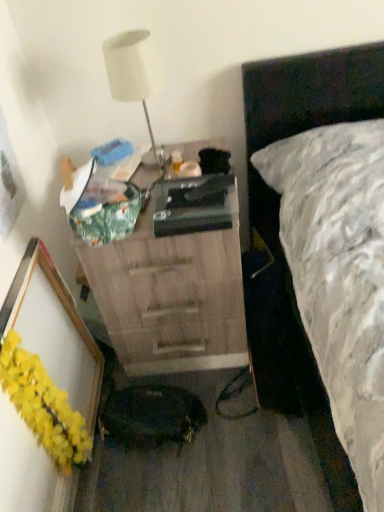
This screenshot has height=512, width=384. In order to click on yellow fluffy garland at lower left in this screenshot , I will do `click(43, 405)`.

Locate an element on the screen. Image resolution: width=384 pixels, height=512 pixels. wooden chest of drawers at center is located at coordinates (173, 290).

Are white matte lamp at upper left and yellow fluffy garland at lower left far apart?

That's not correct — white matte lamp at upper left is a little close to yellow fluffy garland at lower left.

Is point (109, 59) farther from viewer compared to point (73, 426)?

That is False.

Which is more to the left, white matte lamp at upper left or yellow fluffy garland at lower left?

Positioned to the left is yellow fluffy garland at lower left.

Between yellow fluffy garland at lower left and white matte lamp at upper left, which one is positioned in front?

yellow fluffy garland at lower left.

Is yellow fluffy garland at lower left positioned beyond the bounds of white matte lamp at upper left?

Yes.

From a real-world perspective, between yellow fluffy garland at lower left and white matte lamp at upper left, who is vertically higher?

white matte lamp at upper left is physically above.

Which is further, (11, 378) or (148, 167)?

Positioned behind is point (148, 167).

Does wooden chest of drawers at center have a greater width compared to white matte lamp at upper left?

A: Correct, the width of wooden chest of drawers at center exceeds that of white matte lamp at upper left.

Which object is closer to the camera, wooden chest of drawers at center or white matte lamp at upper left?

Positioned in front is wooden chest of drawers at center.

Is wooden chest of drawers at center oriented towards white matte lamp at upper left?

No, wooden chest of drawers at center is not turned towards white matte lamp at upper left.

The width and height of the screenshot is (384, 512). In order to click on the chest of drawers that appears below the white matte lamp at upper left (from a real-world perspective) in this screenshot , I will do `click(173, 290)`.

In the image, is wooden chest of drawers at center on the left side or the right side of yellow fluffy garland at lower left?

Based on their positions, wooden chest of drawers at center is located to the right of yellow fluffy garland at lower left.

The height and width of the screenshot is (512, 384). I want to click on chest of drawers on the right of yellow fluffy garland at lower left, so click(173, 290).

What's the angular difference between wooden chest of drawers at center and yellow fluffy garland at lower left's facing directions?

90 degrees.

Is wooden chest of drawers at center aimed at yellow fluffy garland at lower left?

No, wooden chest of drawers at center does not turn towards yellow fluffy garland at lower left.

Does white matte lamp at upper left have a smaller size compared to wooden chest of drawers at center?

Correct, white matte lamp at upper left occupies less space than wooden chest of drawers at center.

Is white matte lamp at upper left far away from wooden chest of drawers at center?

That's not correct — white matte lamp at upper left is a little close to wooden chest of drawers at center.

Do you think white matte lamp at upper left is within wooden chest of drawers at center, or outside of it?

white matte lamp at upper left is not inside wooden chest of drawers at center, it's outside.

Is wooden chest of drawers at center inside yellow fluffy garland at lower left?

No, wooden chest of drawers at center is not surrounded by yellow fluffy garland at lower left.

Is yellow fluffy garland at lower left positioned far away from wooden chest of drawers at center?

That's not correct — yellow fluffy garland at lower left is a little close to wooden chest of drawers at center.

Between yellow fluffy garland at lower left and wooden chest of drawers at center, which one has smaller width?

yellow fluffy garland at lower left.

You are a GUI agent. You are given a task and a screenshot of the screen. Output one action in this format:
    pyautogui.click(x=<x>, y=<y>)
    Task: Click on the flower below the white matte lamp at upper left (from a real-world perspective)
    Image resolution: width=384 pixels, height=512 pixels.
    Given the screenshot: What is the action you would take?
    pyautogui.click(x=43, y=405)

In the image, there is a yellow fluffy garland at lower left. Find the location of `lamp above it (from the image's perspective)`. lamp above it (from the image's perspective) is located at coordinates (133, 77).

Estimate the real-world distances between objects in this image. Which object is closer to white matte lamp at upper left, wooden chest of drawers at center or yellow fluffy garland at lower left?

The object closer to white matte lamp at upper left is wooden chest of drawers at center.

Which object lies further to the anchor point wooden chest of drawers at center, white matte lamp at upper left or yellow fluffy garland at lower left?

yellow fluffy garland at lower left is positioned further to the anchor wooden chest of drawers at center.

From the image, which object appears to be farther from yellow fluffy garland at lower left, white matte lamp at upper left or wooden chest of drawers at center?

white matte lamp at upper left lies further to yellow fluffy garland at lower left than the other object.

Which object lies nearer to the anchor point yellow fluffy garland at lower left, wooden chest of drawers at center or white matte lamp at upper left?

wooden chest of drawers at center lies closer to yellow fluffy garland at lower left than the other object.

Estimate the real-world distances between objects in this image. Which object is further from wooden chest of drawers at center, yellow fluffy garland at lower left or white matte lamp at upper left?

Among the two, yellow fluffy garland at lower left is located further to wooden chest of drawers at center.

Looking at the image, which one is located closer to white matte lamp at upper left, yellow fluffy garland at lower left or wooden chest of drawers at center?

The object closer to white matte lamp at upper left is wooden chest of drawers at center.

Image resolution: width=384 pixels, height=512 pixels. I want to click on the chest of drawers that lies between white matte lamp at upper left and yellow fluffy garland at lower left from top to bottom, so click(x=173, y=290).